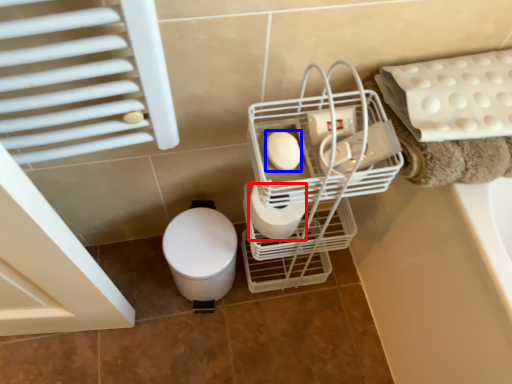
Question: Which object is further to the camera taking this photo, toilet paper (highlighted by a red box) or toilet paper (highlighted by a blue box)?

Choices:
 (A) toilet paper
 (B) toilet paper

Answer: (A)